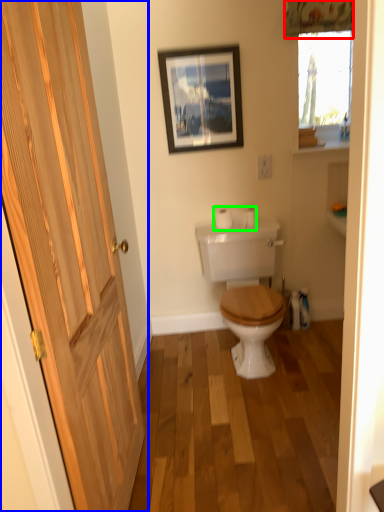
Question: Considering the real-world distances, which object is closest to curtain (highlighted by a red box)? door (highlighted by a blue box) or toilet paper (highlighted by a green box).

Choices:
 (A) door
 (B) toilet paper

Answer: (B)